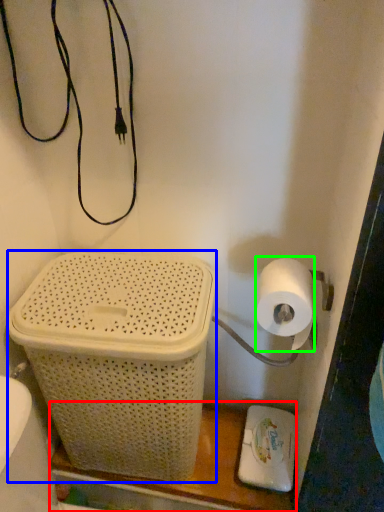
Question: Which object is the farthest from shelf (highlighted by a red box)? Choose among these: basket container (highlighted by a blue box) or toilet paper (highlighted by a green box).

Choices:
 (A) basket container
 (B) toilet paper

Answer: (B)